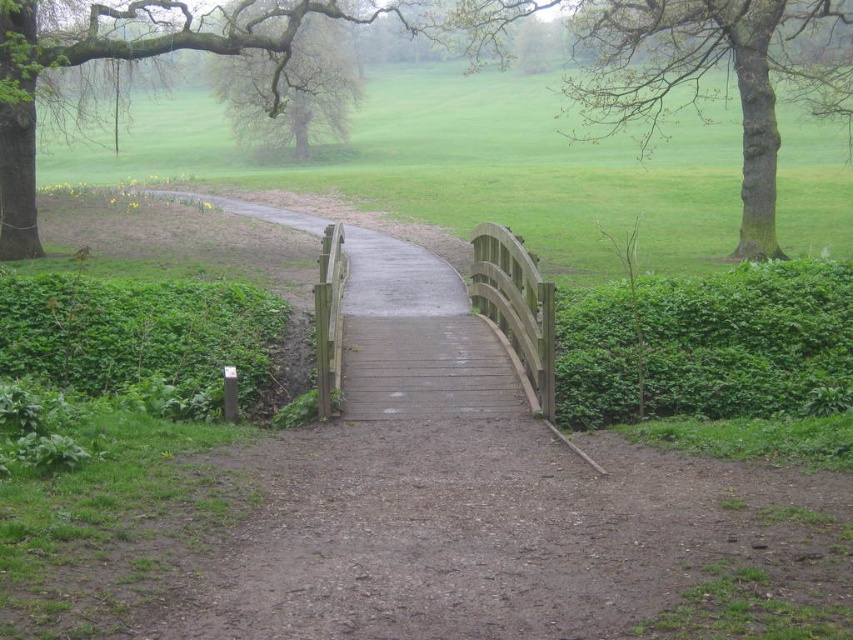
Does green leafy hedge at right appear over smooth brown tree at upper center?

No.

Which of these two, green leafy hedge at right or smooth brown tree at upper center, stands shorter?

green leafy hedge at right

Based on the photo, measure the distance between green leafy hedge at right and camera.

A distance of 11.95 meters exists between green leafy hedge at right and camera.

Where is `green leafy hedge at right`? This screenshot has width=853, height=640. green leafy hedge at right is located at coordinates (703, 342).

Is green rough bark tree at upper right to the left of green leafy hedge at lower left from the viewer's perspective?

Incorrect, green rough bark tree at upper right is not on the left side of green leafy hedge at lower left.

Locate an element on the screen. Image resolution: width=853 pixels, height=640 pixels. green rough bark tree at upper right is located at coordinates (712, 68).

Identify the location of green rough bark tree at upper right. (712, 68).

Does green rough bark tree at upper right appear over smooth brown tree at upper center?

Correct, green rough bark tree at upper right is located above smooth brown tree at upper center.

Does green rough bark tree at upper right have a lesser width compared to smooth brown tree at upper center?

No.

Find the location of a particular element. green rough bark tree at upper right is located at coordinates (712, 68).